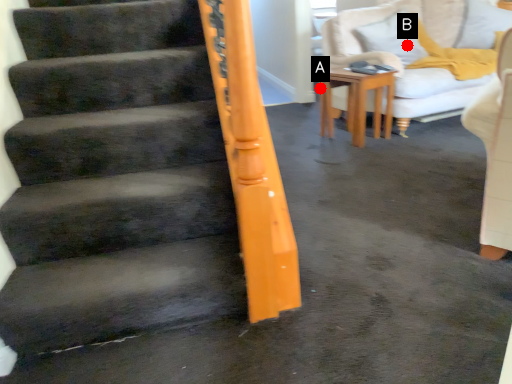
Question: Two points are circled on the image, labeled by A and B beside each circle. Which point is farther to the camera?

Choices:
 (A) A is further
 (B) B is further

Answer: (A)